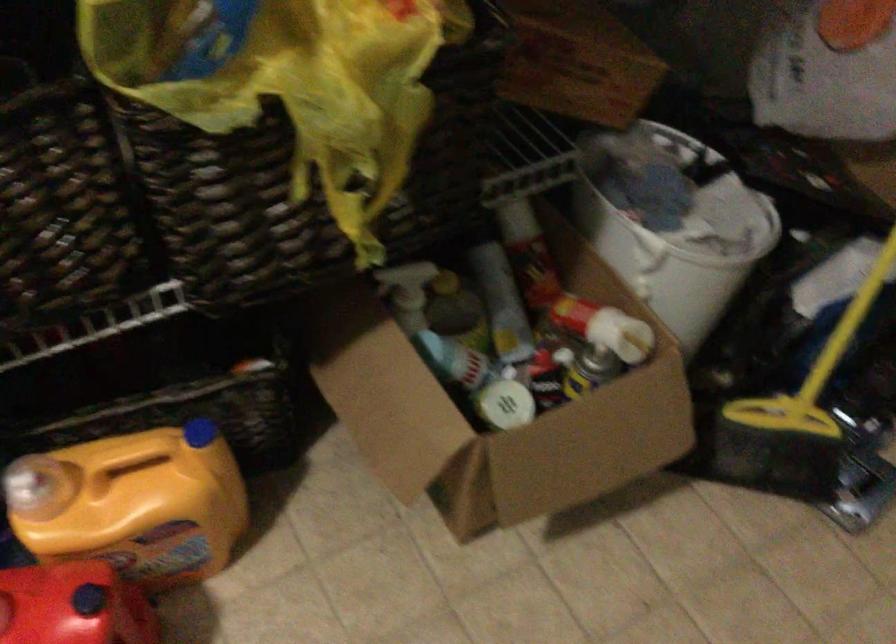
Where is `detergent jug handle`? detergent jug handle is located at coordinates (133, 504).